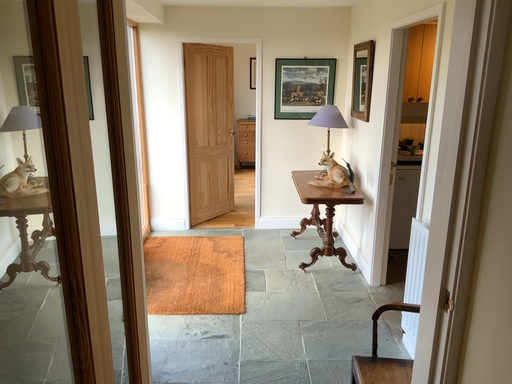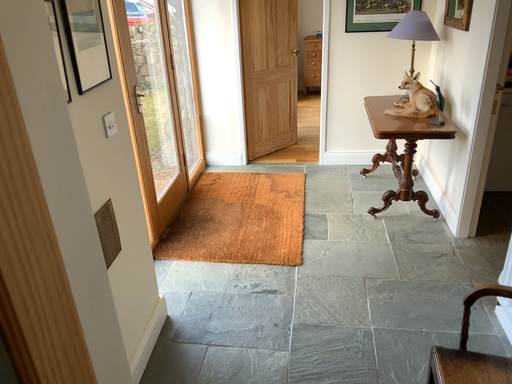
Question: Which way did the camera rotate in the video?

Choices:
 (A) rotated right
 (B) rotated left

Answer: (B)